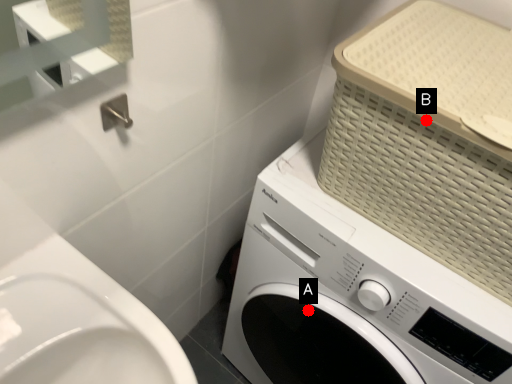
Question: Two points are circled on the image, labeled by A and B beside each circle. Which point is farther to the camera?

Choices:
 (A) A is further
 (B) B is further

Answer: (A)